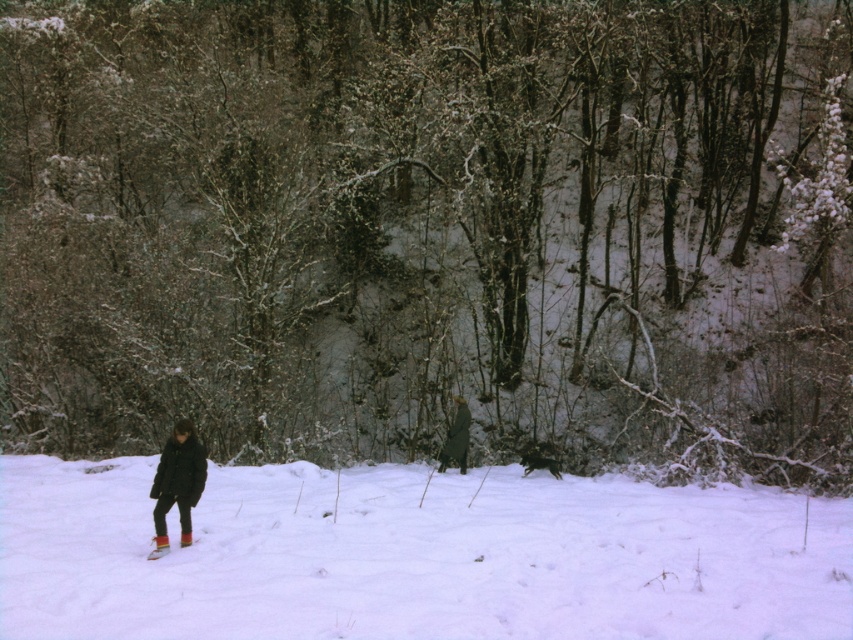
You are a photographer planning to take a photo of the matte black jacket at center and the multicolored fabric ski at lower left. To ensure both are in the frame, should you adjust your camera to focus on the left or the right side of the scene?

You should focus on the right side of the scene because the matte black jacket at center is to the right of the multicolored fabric ski at lower left, ensuring both are captured in the frame.

You are a photographer standing in the winter forest scene. You want to take a photo that includes both the matte black jacket at center and the green wool coat at center. The camera you are using has a maximum focus range of 10 meters. Will both subjects be in focus?

The matte black jacket at center and green wool coat at center are 10.59 meters apart from each other, which exceeds the camera maximum focus range of 10 meters. Therefore, both subjects cannot be in focus simultaneously.